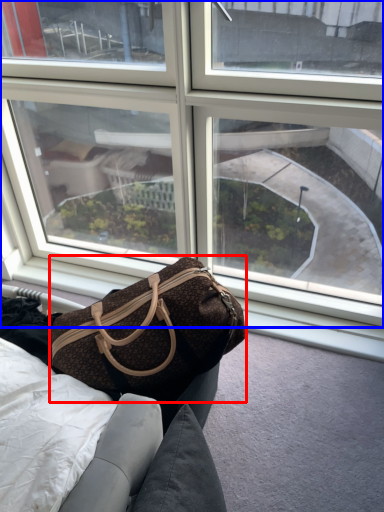
Question: Which object appears closest to the camera in this image, handbag (highlighted by a red box) or window (highlighted by a blue box)?

Choices:
 (A) handbag
 (B) window

Answer: (A)